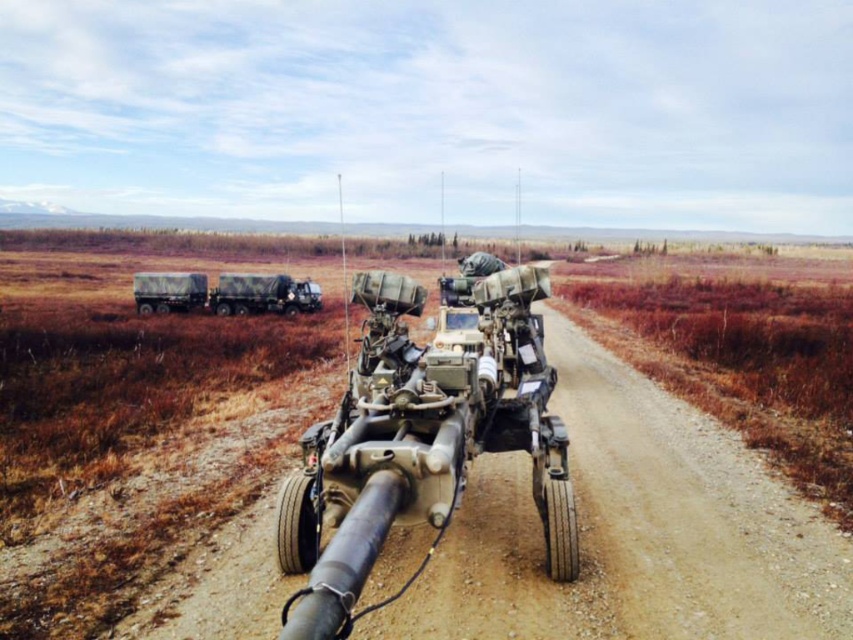
You are a military engineer assessing the road conditions. The road can only support vehicles narrower than 2.5 meters. You observe the muddy camouflage truck at left and the camouflage fabric truck at left. Which truck is narrower and can safely pass through?

The muddy camouflage truck at left is narrower than the camouflage fabric truck at left, so it can safely pass through the road.

You are a military commander planning to move your troops along the dirt road. You have two marked points on your map, point (497, 314) and point (199, 301). Which point should you choose if you want to position your troops closer to the military vehicle in the foreground?

Point (497, 314) is in front of point (199, 301), so choosing point (497, 314) would place your troops closer to the military vehicle in the foreground.

Looking at this image, you are a military planner analyzing the terrain. The camouflage fabric tank at center is positioned at coordinates point A. If you need to move supplies from the tank to a forward base located at coordinates point B, which is at point C, which direction should you head from the tank to reach the base?

The camouflage fabric tank at center is located at point A. To reach the forward base at point C from point A, you should head in the direction of point C, which is the correct path based on the coordinates provided.